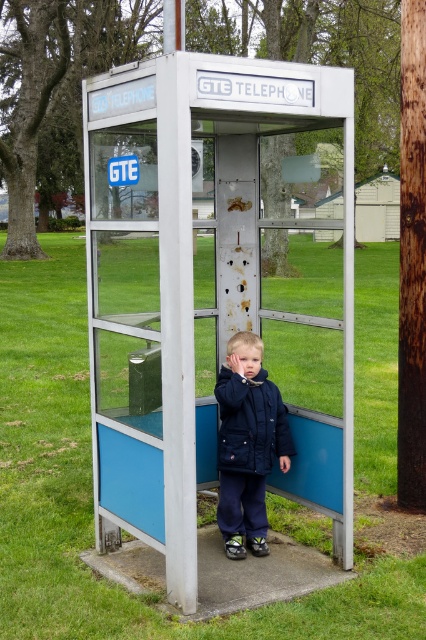
Question: Can you confirm if metallic blue telephone booth at center is bigger than dark blue puffy coat at center?

Choices:
 (A) no
 (B) yes

Answer: (B)

Question: Is the position of metallic blue telephone booth at center more distant than that of dark blue puffy coat at center?

Choices:
 (A) yes
 (B) no

Answer: (B)

Question: Which point is closer to the camera?

Choices:
 (A) (155, 433)
 (B) (252, 410)

Answer: (A)

Question: Which of the following is the farthest from the observer?

Choices:
 (A) (270, 419)
 (B) (261, 317)

Answer: (B)

Question: Is metallic blue telephone booth at center smaller than dark blue puffy coat at center?

Choices:
 (A) no
 (B) yes

Answer: (A)